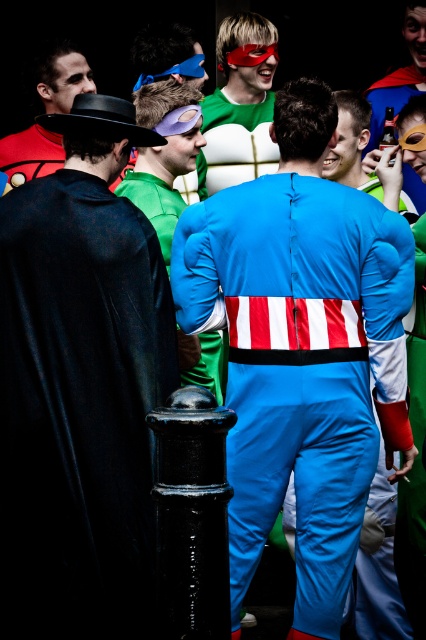
You are standing at the center of the scene and want to hand a gift to the person wearing the black velvet cape at left. In which direction should you move to reach them?

The black velvet cape at left is located at point 0.639 on the x axis and 0.185 on the y axis. Since you are at the center, you should move towards the left and slightly downward to reach the person wearing the black velvet cape at left.

You are a photographer standing at the camera position. You want to take a photo of the blue spandex suit at center. However, you notice that the suit is 6.33 meters away. Do you need to adjust your camera settings to focus on the suit?

The blue spandex suit at center is 6.33 meters away from the camera. Since most cameras can focus up to several meters away, the photographer can likely capture the suit without needing to adjust the focus settings, as 6.33 meters is within the typical focusing range.

You are a photographer at the event and want to capture a closeup of both the green fabric mask at upper center and the matte black mask at upper left in a single frame. Given their sizes, which mask would you need to position closer to the camera to ensure both appear similarly sized in the photo?

The green fabric mask at upper center is larger in size than the matte black mask at upper left. To make both masks appear similarly sized in the photo, you should position the matte black mask at upper left closer to the camera since it is smaller and needs to be magnified to match the size of the larger green fabric mask at upper center.